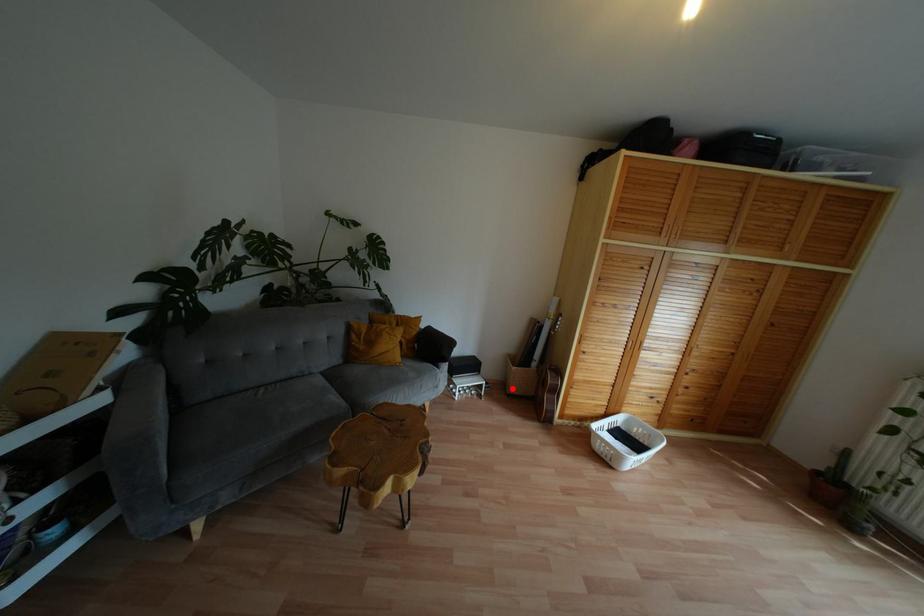
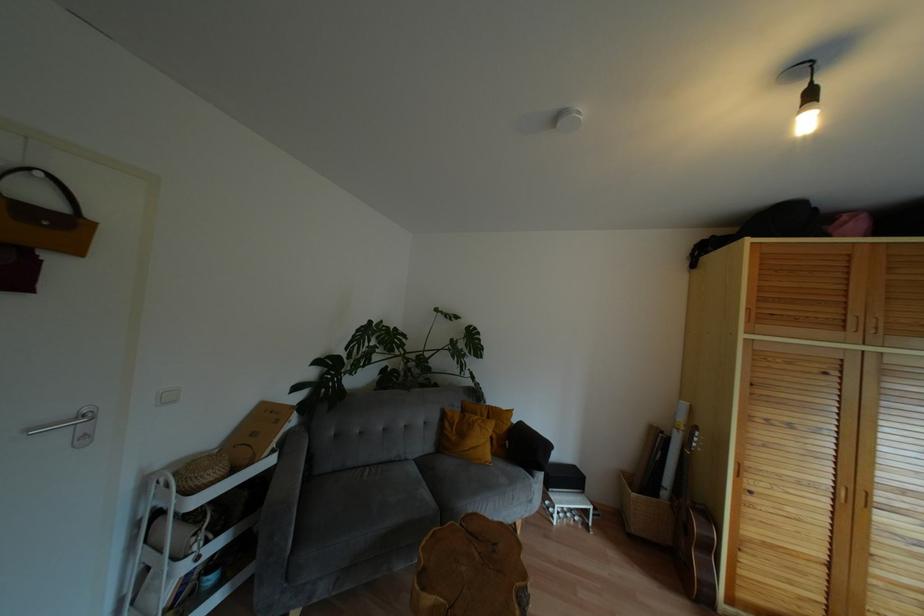
Where in the second image is the point corresponding to the highlighted location from the first image?

(636, 527)